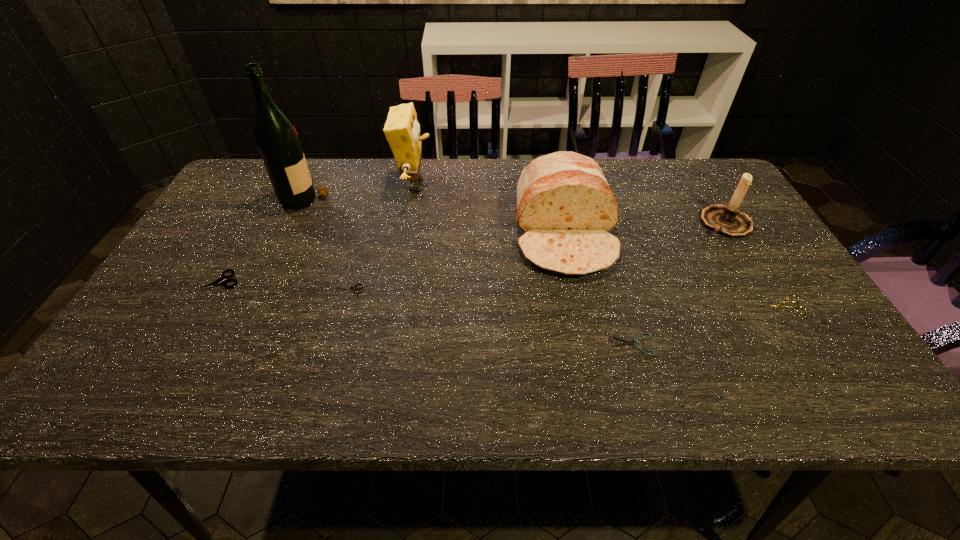
Locate an element on the screen. wine bottle that is at the far edge is located at coordinates (277, 140).

You are a GUI agent. You are given a task and a screenshot of the screen. Output one action in this format:
    pyautogui.click(x=<x>, y=<y>)
    Task: Click on the sponge located in the far edge section of the desktop
    This screenshot has width=960, height=540.
    Given the screenshot: What is the action you would take?
    pyautogui.click(x=402, y=131)

Where is `bread present at the far edge`? bread present at the far edge is located at coordinates (565, 206).

Identify the location of object that is positioned at the left edge. The image size is (960, 540). click(219, 281).

I want to click on candle holder that is positioned at the right edge, so click(x=727, y=220).

The width and height of the screenshot is (960, 540). In order to click on shears that is at the right edge in this screenshot , I will do `click(780, 305)`.

In the image, there is a desktop. Identify the location of vacant space at the far edge. This screenshot has width=960, height=540. (489, 194).

The image size is (960, 540). What are the coordinates of `blank space at the near edge of the desktop` in the screenshot? It's located at (420, 377).

You are a GUI agent. You are given a task and a screenshot of the screen. Output one action in this format:
    pyautogui.click(x=<x>, y=<y>)
    Task: Click on the vacant area at the left edge
    Image resolution: width=960 pixels, height=540 pixels.
    Given the screenshot: What is the action you would take?
    pyautogui.click(x=154, y=319)

This screenshot has width=960, height=540. What are the coordinates of `free space at the right edge` in the screenshot? It's located at (798, 315).